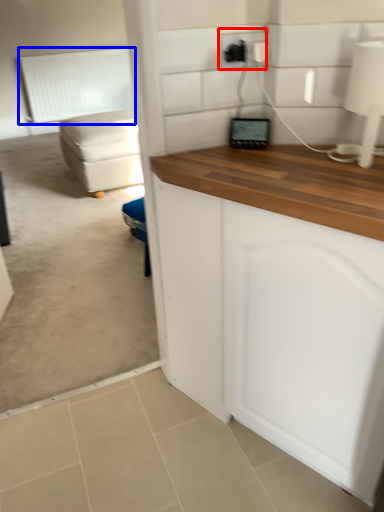
Question: Which of the following is the closest to the observer, electric outlet (highlighted by a red box) or radiator (highlighted by a blue box)?

Choices:
 (A) electric outlet
 (B) radiator

Answer: (A)